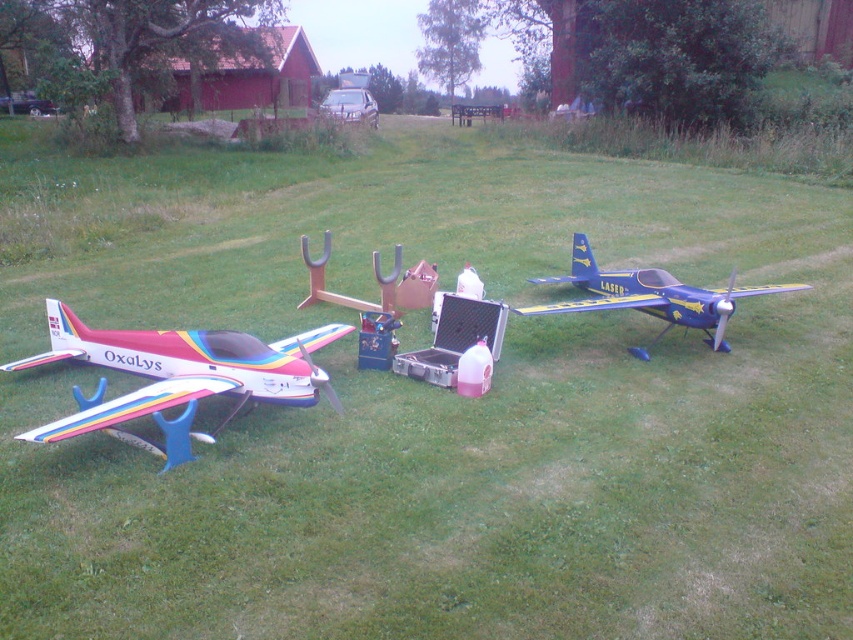
You are a visitor at an outdoor model airplane exhibition. You notice the rainbow painted model airplane at left and the blue metallic airplane at right. Which airplane is closer to you?

The rainbow painted model airplane at left is closer to you because it is positioned in front of the blue metallic airplane at right.

You are a museum curator who needs to move the rainbow painted model airplane at left closer to the blue metallic airplane at right. The minimum safe distance between them should be 2 meters to ensure visitors can walk around both. Is the current distance sufficient?

The distance between the rainbow painted model airplane at left and the blue metallic airplane at right is 2.23 meters, which is more than the required 2 meters. Therefore, the current distance is sufficient to allow visitors to walk around both models safely.